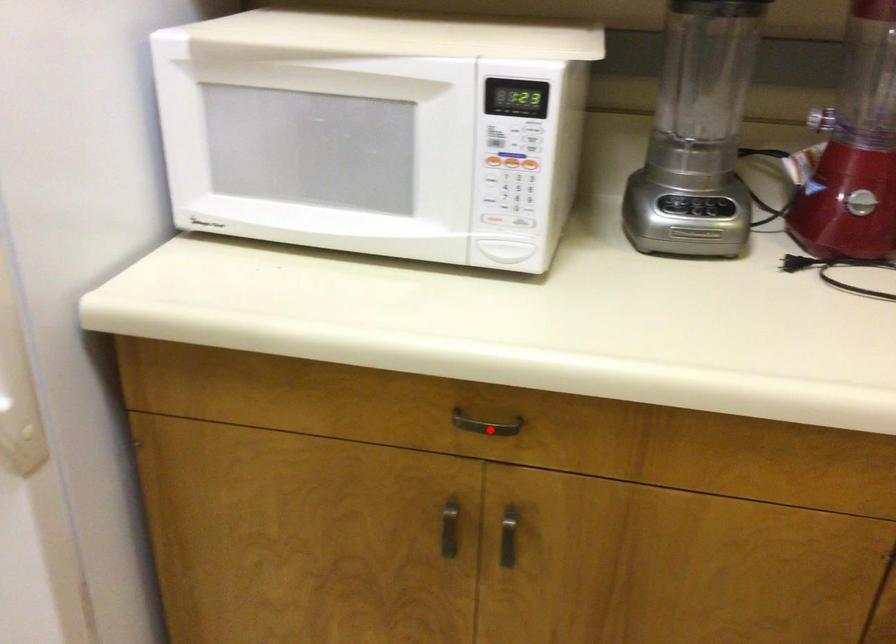
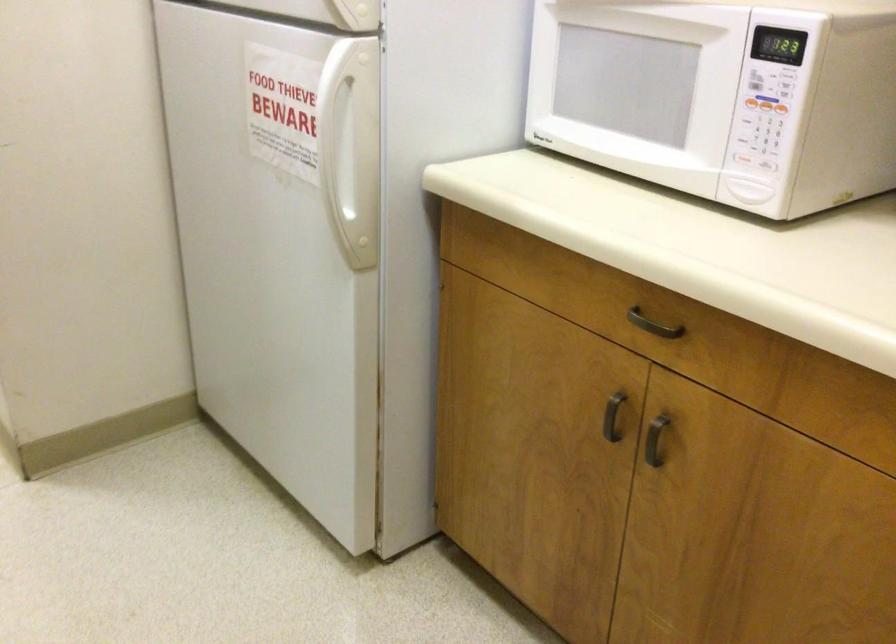
Question: A red point is marked in image1. In image2, is the corresponding 3D point closer to the camera or farther? Reply with the corresponding letter.

Choices:
 (A) The corresponding 3D point is closer.
 (B) The corresponding 3D point is farther.

Answer: (B)